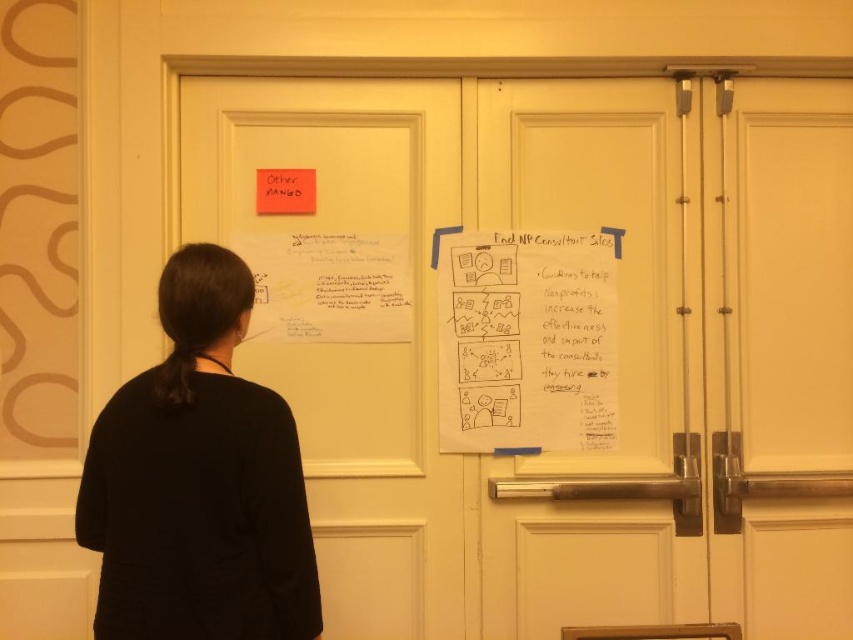
Question: Can you confirm if white paper at right is positioned to the right of yellow paper poster at center?

Choices:
 (A) no
 (B) yes

Answer: (B)

Question: Among these points, which one is farthest from the camera?

Choices:
 (A) (247, 582)
 (B) (611, 333)
 (C) (270, 225)

Answer: (B)

Question: Based on their relative distances, which object is nearer to the white paper at upper left?

Choices:
 (A) black fabric at left
 (B) white paper at right
 (C) yellow paper poster at center
 (D) white matte door at center

Answer: (C)

Question: Estimate the real-world distances between objects in this image. Which object is farther from the yellow paper poster at center?

Choices:
 (A) white matte door at center
 (B) white paper at upper left
 (C) white paper at right
 (D) black fabric at left

Answer: (D)

Question: Where is white paper at upper left located in relation to black fabric at left in the image?

Choices:
 (A) right
 (B) left

Answer: (A)

Question: Is the position of white paper at upper left more distant than that of yellow paper poster at center?

Choices:
 (A) yes
 (B) no

Answer: (B)